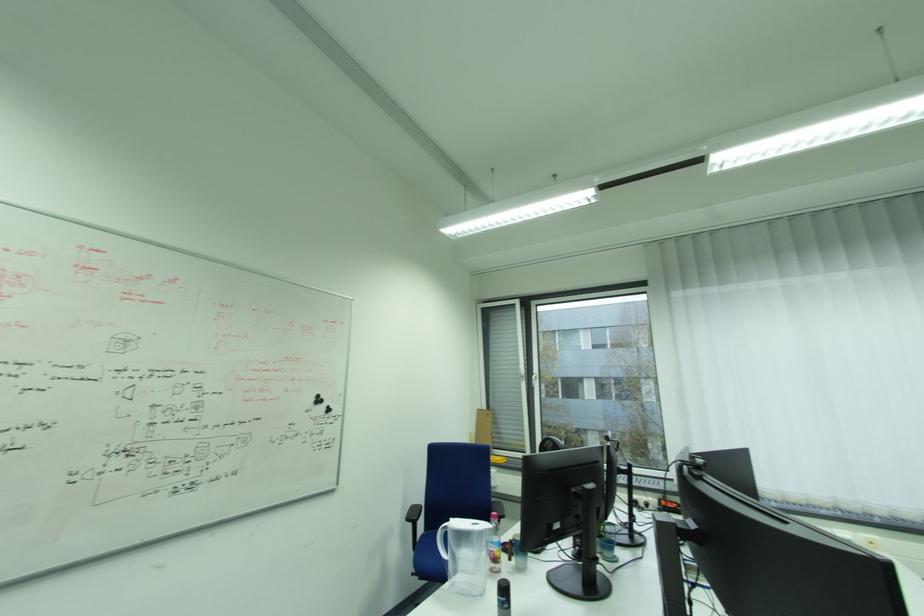
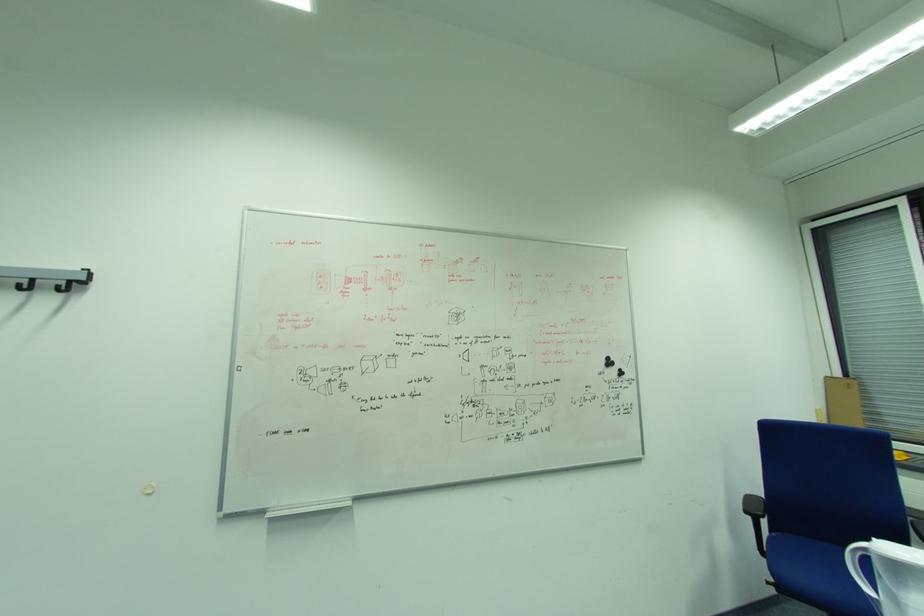
Question: The first image is from the beginning of the video and the second image is from the end. How did the camera likely rotate when shooting the video?

Choices:
 (A) Left
 (B) Right
 (C) Up
 (D) Down

Answer: (A)